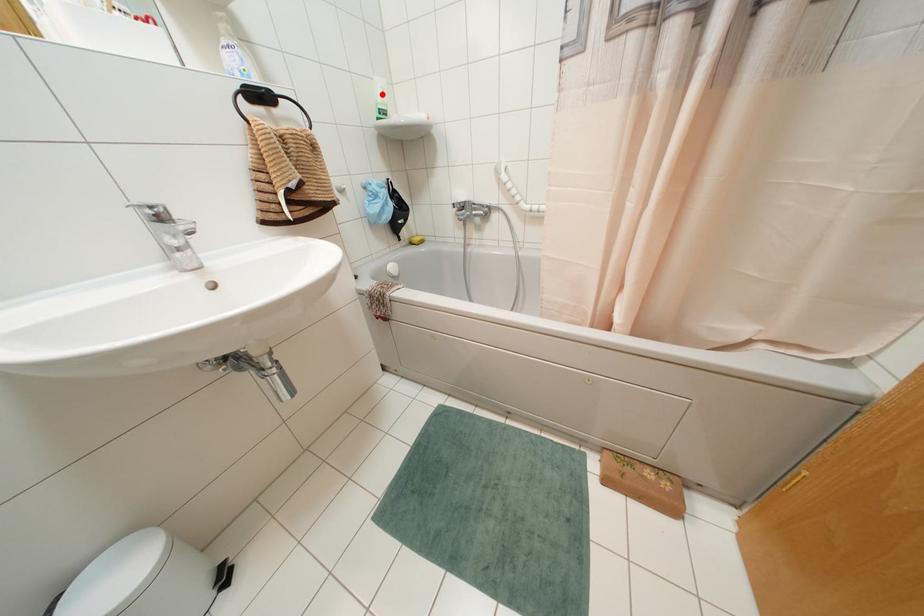
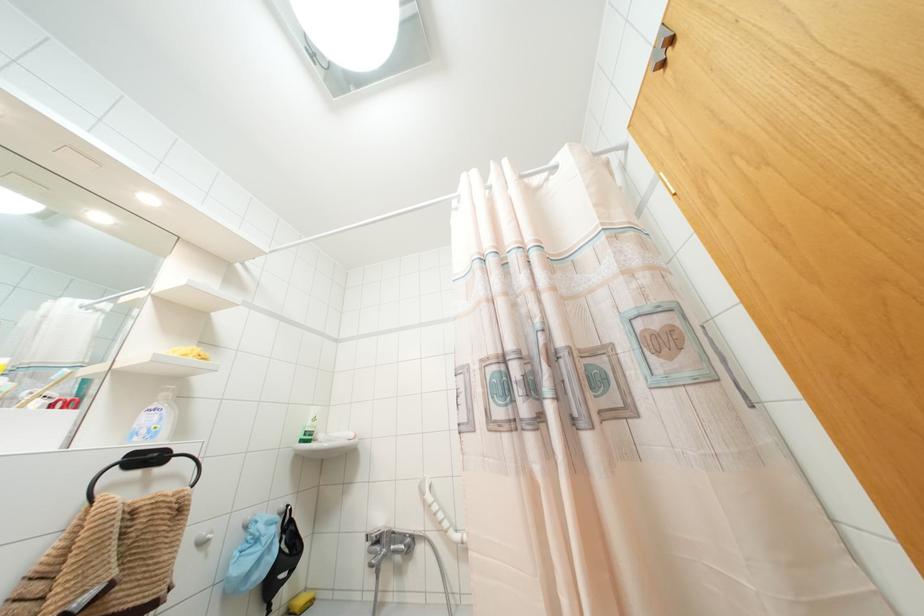
Question: I am providing you with two images of the same scene from different viewpoints. Image1 has a red point marked. In image2, the corresponding 3D location appears at what relative position? Reply with the corresponding letter.

Choices:
 (A) Closer
 (B) Farther

Answer: (B)